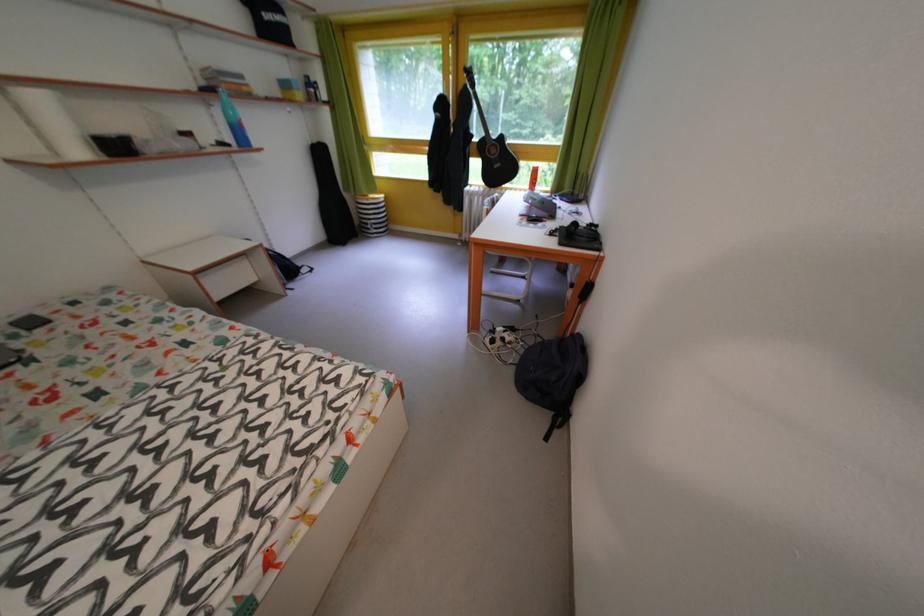
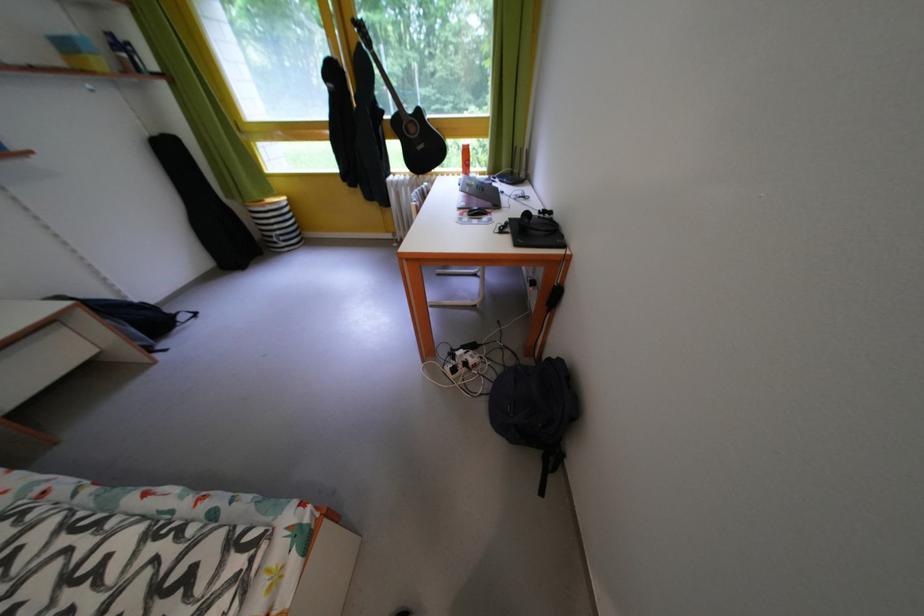
Question: Which direction would the cameraman need to move to produce the second image? Reply with the corresponding letter.

Choices:
 (A) Left
 (B) Right
 (C) Forward
 (D) Backward

Answer: (C)